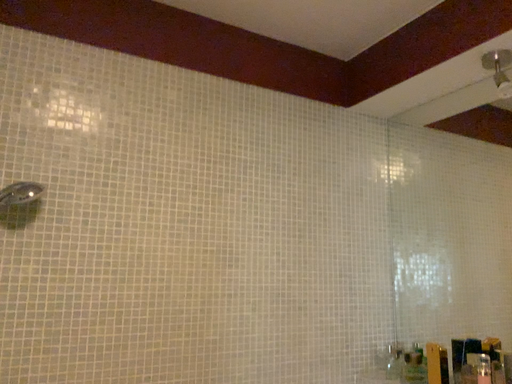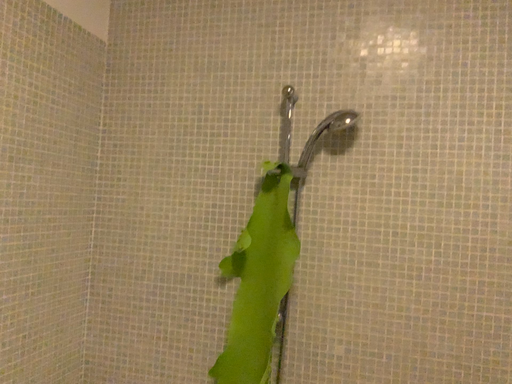
Question: How did the camera likely rotate when shooting the video?

Choices:
 (A) rotated upward
 (B) rotated downward

Answer: (B)